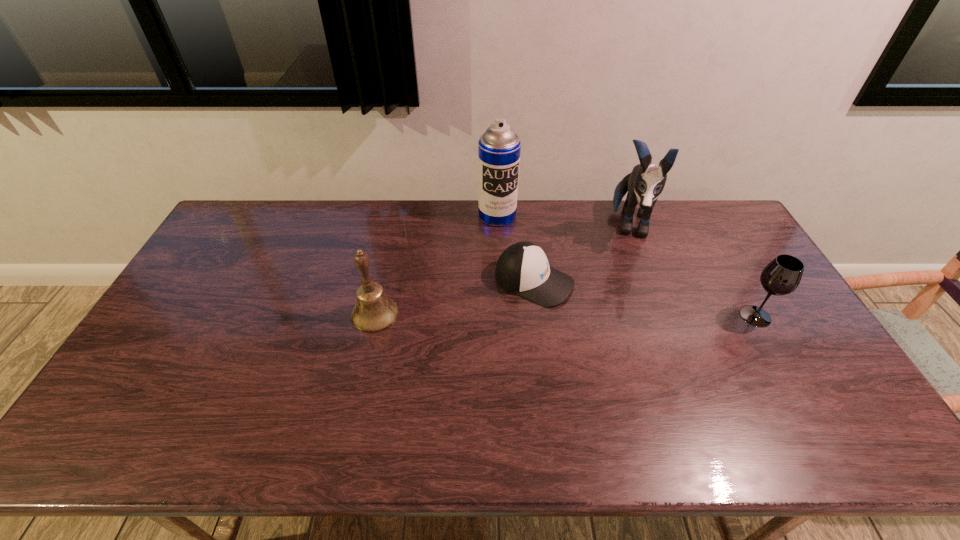
The image size is (960, 540). In order to click on bell in this screenshot , I will do `click(374, 312)`.

Find the location of a particular element. the leftmost object is located at coordinates (374, 312).

Identify the location of the rightmost object. (781, 276).

Locate an element on the screen. The width and height of the screenshot is (960, 540). wineglass is located at coordinates (781, 276).

I want to click on aerosol can, so click(499, 147).

Where is `cap`? Image resolution: width=960 pixels, height=540 pixels. cap is located at coordinates (523, 268).

This screenshot has width=960, height=540. I want to click on puppy, so click(x=645, y=183).

Image resolution: width=960 pixels, height=540 pixels. In order to click on free space located on the back of the bell in this screenshot , I will do `click(391, 241)`.

Locate an element on the screen. vacant space located 0.200m on the back of the wineglass is located at coordinates (723, 260).

The height and width of the screenshot is (540, 960). In order to click on vacant area situated 0.240m on the label side of the aerosol can in this screenshot , I will do `click(515, 273)`.